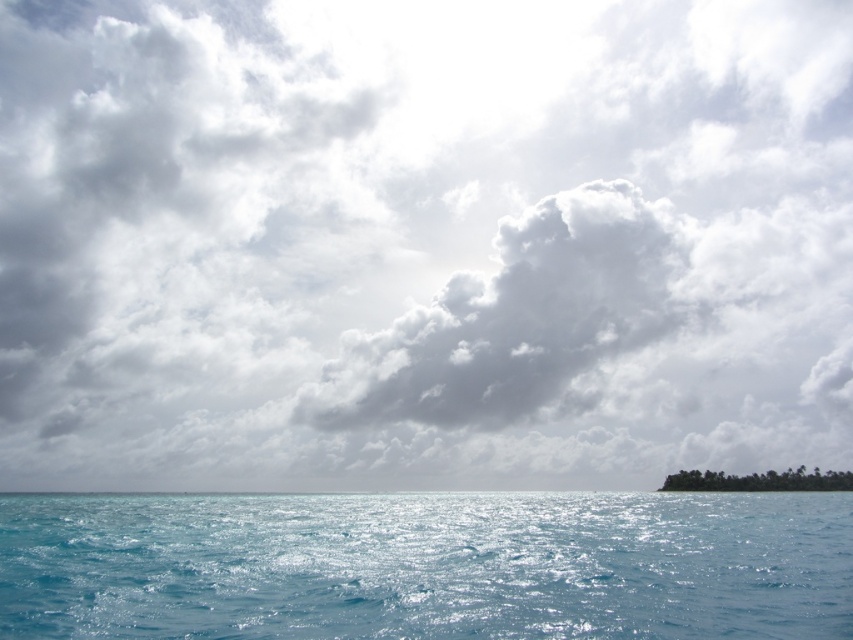
Is clear blue water at lower center bigger than white fluffy cloud at center?

No, clear blue water at lower center is not bigger than white fluffy cloud at center.

Looking at this image, does clear blue water at lower center appear under white fluffy cloud at center?

Yes.

This screenshot has height=640, width=853. Identify the location of clear blue water at lower center. (427, 564).

Find the location of a particular element. clear blue water at lower center is located at coordinates 427,564.